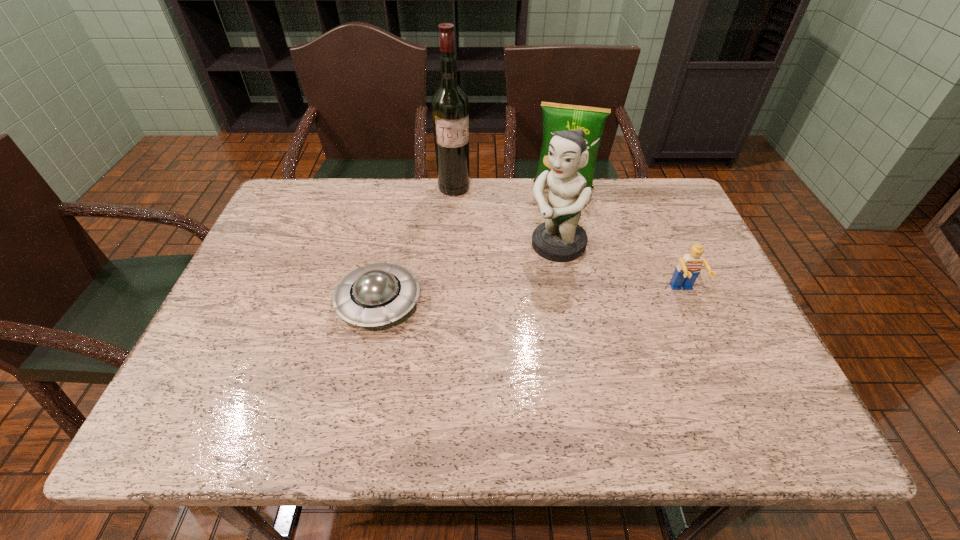
Identify the location of vacant spot on the desktop that is between the leftmost object and the second shortest object and is positioned on the front-facing side of the second tallest object. The image size is (960, 540). (492, 299).

The height and width of the screenshot is (540, 960). Find the location of `free space on the desktop that is between the shortest object and the second shortest object and is positioned on the front-facing side of the third tallest object`. free space on the desktop that is between the shortest object and the second shortest object and is positioned on the front-facing side of the third tallest object is located at coordinates (544, 296).

Where is `free space on the desktop that is between the saucer and the second shortest object and is positioned on the front and back of the tallest object`? The width and height of the screenshot is (960, 540). free space on the desktop that is between the saucer and the second shortest object and is positioned on the front and back of the tallest object is located at coordinates (499, 298).